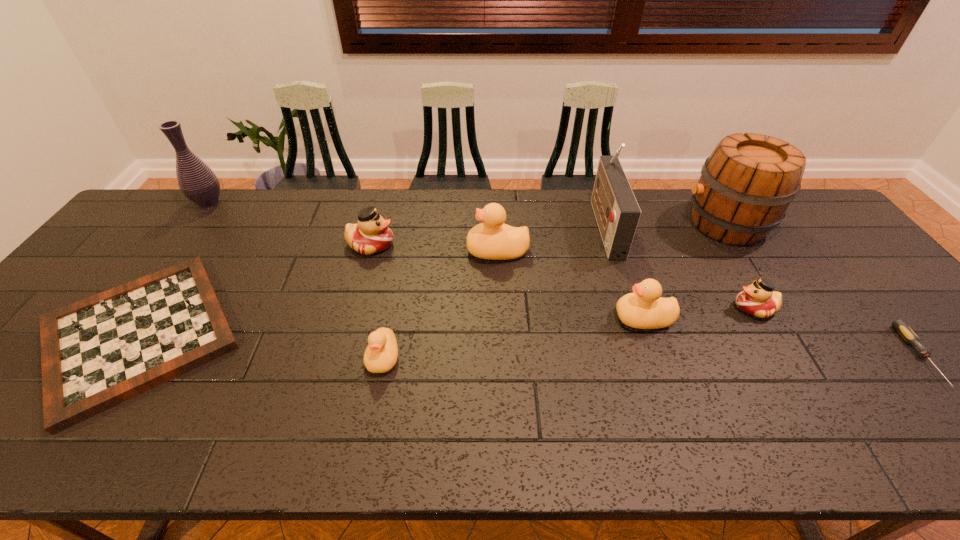
At what (x,y) coordinates should I click in order to perform the action: click on free space located on the face of the rightmost duck. Please return your answer as a coordinate pair (x, y). The width and height of the screenshot is (960, 540). Looking at the image, I should click on (680, 308).

At what (x,y) coordinates should I click in order to perform the action: click on free space located 0.180m on the face of the rightmost duck. Please return your answer as a coordinate pair (x, y). This screenshot has height=540, width=960. Looking at the image, I should click on (664, 308).

You are a GUI agent. You are given a task and a screenshot of the screen. Output one action in this format:
    pyautogui.click(x=<x>, y=<y>)
    Task: Click on the blank area located on the face of the leftmost yellow duck
    
    Given the screenshot: What is the action you would take?
    pyautogui.click(x=369, y=437)

Identify the location of vase located at the far edge. (196, 180).

Where is `radio receiver that is at the far edge`? The height and width of the screenshot is (540, 960). radio receiver that is at the far edge is located at coordinates (617, 213).

Locate an element on the screen. The image size is (960, 540). cider at the far edge is located at coordinates (746, 185).

You are a GUI agent. You are given a task and a screenshot of the screen. Output one action in this format:
    pyautogui.click(x=<x>, y=<y>)
    Task: Click on the duck at the far edge
    
    Given the screenshot: What is the action you would take?
    pyautogui.click(x=371, y=235)

At what (x,y) coordinates should I click in order to perform the action: click on object present at the left edge. Please return your answer as a coordinate pair (x, y). Looking at the image, I should click on (196, 180).

Image resolution: width=960 pixels, height=540 pixels. What are the coordinates of `object that is at the right edge` in the screenshot? It's located at (900, 325).

Locate an element on the screen. The height and width of the screenshot is (540, 960). object positioned at the far left corner is located at coordinates (196, 180).